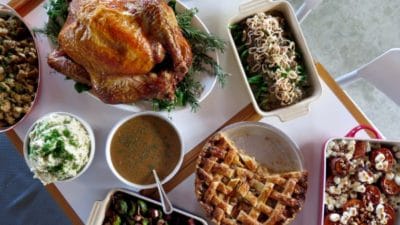
Image resolution: width=400 pixels, height=225 pixels. Identify the location of spoon. (165, 199).